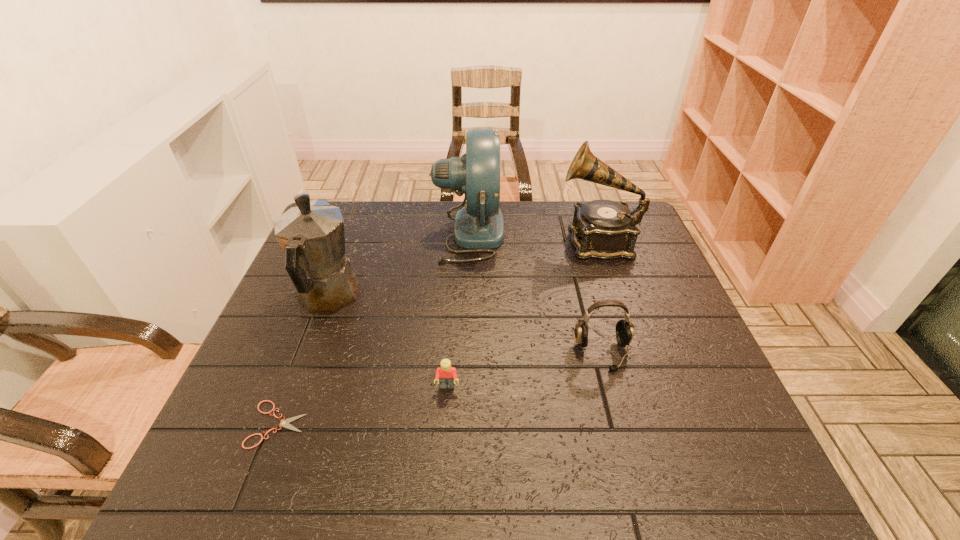
Where is `vacant area situated on the horn of the phonograph record`? vacant area situated on the horn of the phonograph record is located at coordinates (470, 241).

Find the location of a particular element. The height and width of the screenshot is (540, 960). free space located on the horn of the phonograph record is located at coordinates (437, 241).

Locate an element on the screen. This screenshot has width=960, height=540. free location located 0.160m on the pouring side of the coffeepot is located at coordinates (352, 233).

Find the location of a particular element. free location located 0.220m on the pouring side of the coffeepot is located at coordinates (356, 222).

Identify the location of free space located on the pouring side of the coffeepot. The height and width of the screenshot is (540, 960). (352, 233).

The image size is (960, 540). I want to click on free space located with the microphone on the side of the headset, so click(621, 422).

What are the coordinates of `free space located on the face of the Lego` in the screenshot? It's located at (444, 441).

This screenshot has height=540, width=960. What are the coordinates of `free space located on the back of the shortest object` in the screenshot? It's located at (323, 306).

The width and height of the screenshot is (960, 540). Identify the location of fan that is at the far edge. (479, 226).

This screenshot has width=960, height=540. What are the coordinates of `phonograph record that is positioned at the far edge` in the screenshot? It's located at (604, 229).